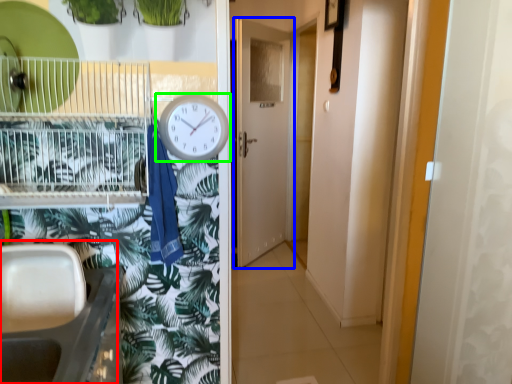
Question: Which object is positioned farthest from sink (highlighted by a red box)? Select from door (highlighted by a blue box) and clock (highlighted by a green box).

Choices:
 (A) door
 (B) clock

Answer: (A)